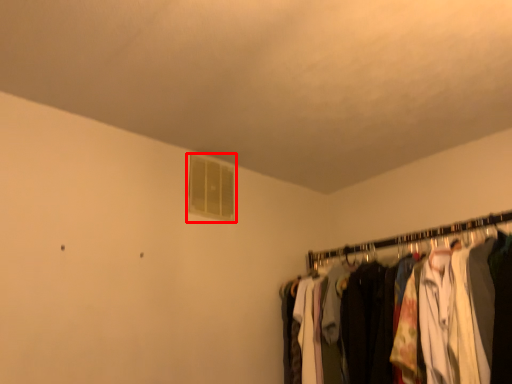
Question: From the image's perspective, considering the relative positions of window (annotated by the red box) and closet in the image provided, where is window (annotated by the red box) located with respect to the staircase?

Choices:
 (A) above
 (B) below

Answer: (A)